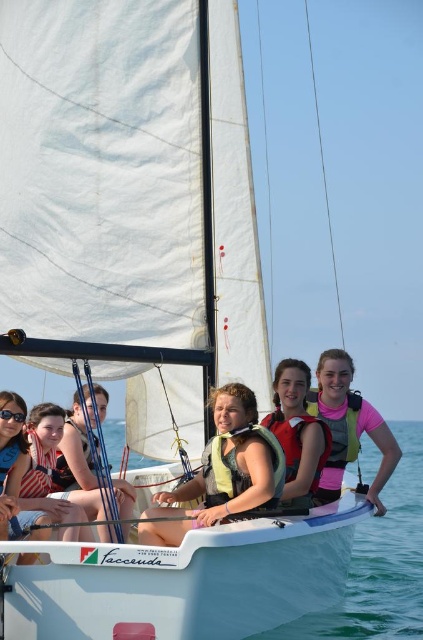
You are on a sailboat named Facceuda with a partially unfurled white sail. You see a matte black life vest at center and a pink fabric life jacket at center. Which life jacket is positioned to the right when viewed from the front?

The pink fabric life jacket at center is positioned to the right of the matte black life vest at center.

You are on a sailboat and need to retrieve an item that fell into the clear blue water at center. The matte yellow life jacket at center is in your way. Can you move the life jacket to access the water?

The clear blue water at center is positioned under the matte yellow life jacket at center, so you cannot directly access the water without moving the life jacket first.